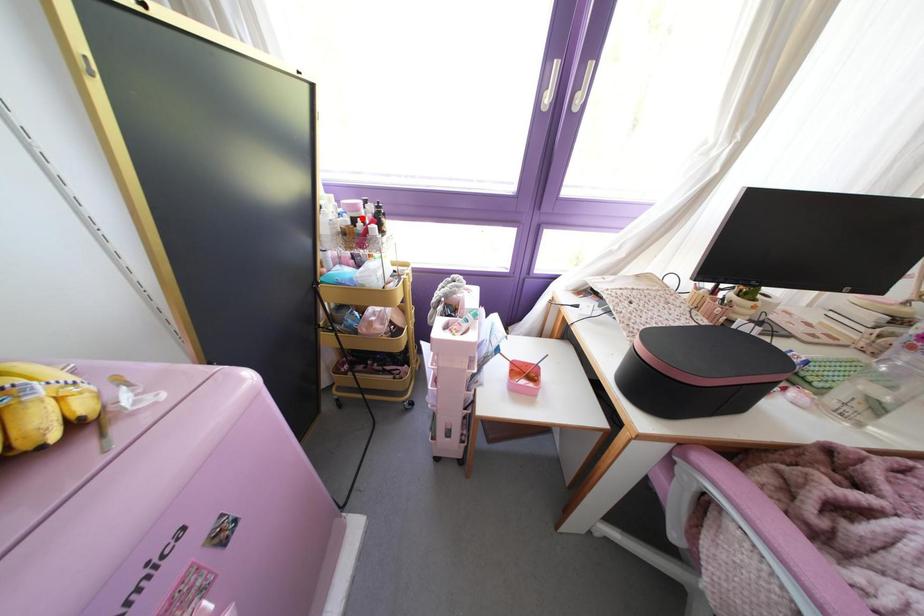
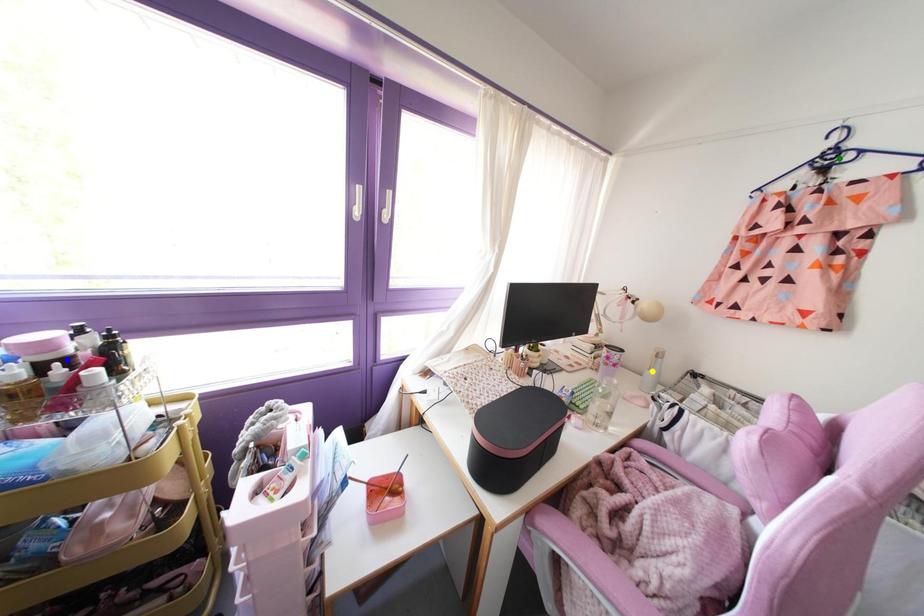
Question: I am providing you with two images of the same scene from different viewpoints. A red point is marked on the first image. You are given multiple points on the second image. Which mark in image 2 goes with the point in image 1?

Choices:
 (A) blue point
 (B) green point
 (C) yellow point

Answer: (A)